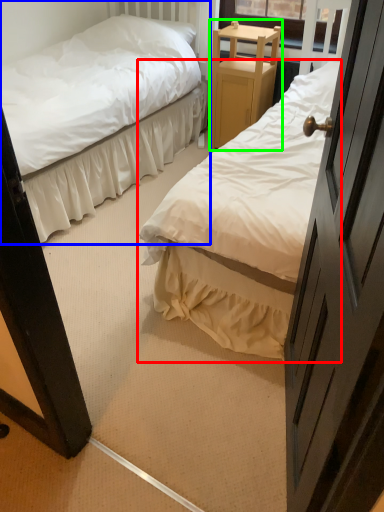
Question: Estimate the real-world distances between objects in this image. Which object is closer to bed (highlighted by a red box), bed (highlighted by a blue box) or furniture (highlighted by a green box)?

Choices:
 (A) bed
 (B) furniture

Answer: (B)